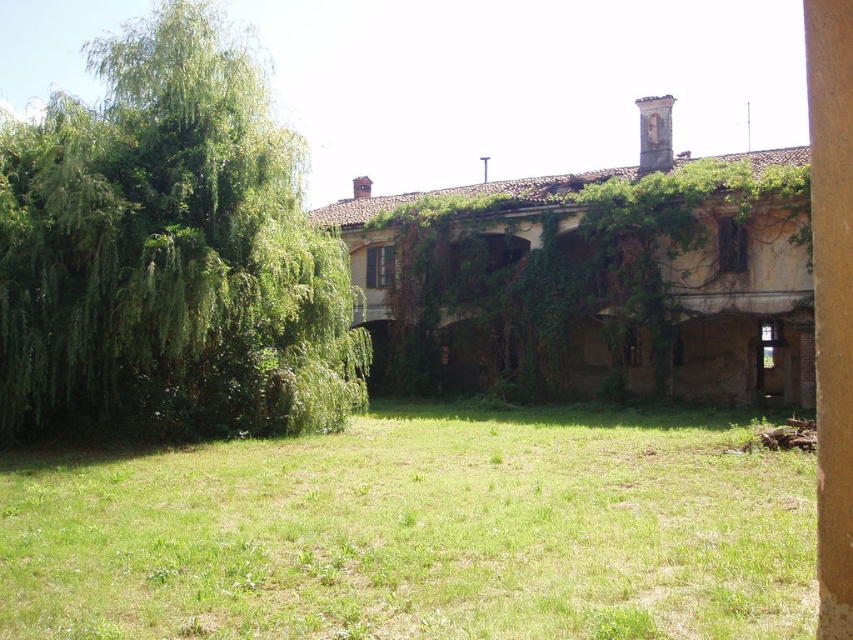
Which is more to the right, green grass at lower center or green leafy tree at left?

green grass at lower center

Who is shorter, green grass at lower center or green leafy tree at left?

With less height is green grass at lower center.

Where is `green grass at lower center`? green grass at lower center is located at coordinates (419, 532).

Find the location of a particular element. green grass at lower center is located at coordinates (419, 532).